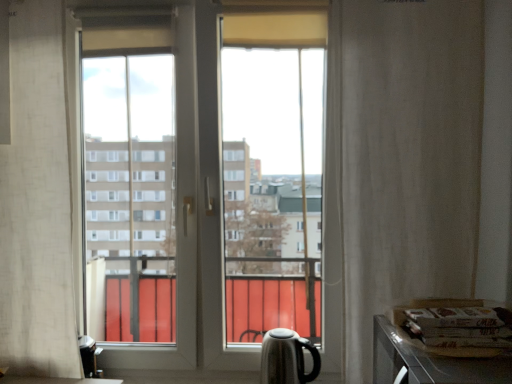
Question: Would you say transparent glass window at center is inside or outside white textured curtain at right, the 2th curtain positioned from the left?

Choices:
 (A) inside
 (B) outside

Answer: (B)

Question: Looking at their shapes, would you say transparent glass window at center is wider or thinner than white textured curtain at right, the 2th curtain positioned from the left?

Choices:
 (A) wide
 (B) thin

Answer: (A)

Question: Estimate the real-world distances between objects in this image. Which object is farther from the white textured curtain at right, the 2th curtain positioned from the left?

Choices:
 (A) black glossy kettle at lower right
 (B) metallic silver counter top at lower right
 (C) white sheer curtain at left, which is the 2th curtain from right to left
 (D) transparent glass window at center

Answer: (C)

Question: Which object is positioned closest to the transparent glass window at center?

Choices:
 (A) white textured curtain at right, the 2th curtain positioned from the left
 (B) white sheer curtain at left, which is the 2th curtain from right to left
 (C) metallic silver counter top at lower right
 (D) black glossy kettle at lower right

Answer: (B)